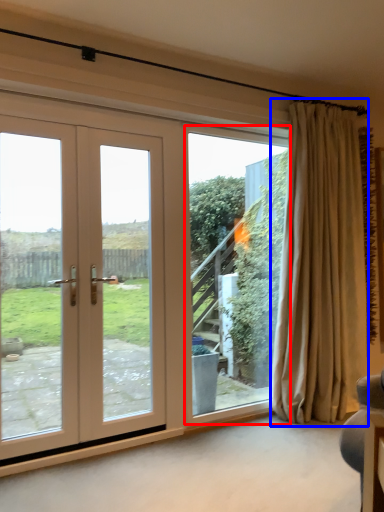
Question: Which of the following is the closest to the observer, window screen (highlighted by a red box) or curtain (highlighted by a blue box)?

Choices:
 (A) window screen
 (B) curtain

Answer: (B)